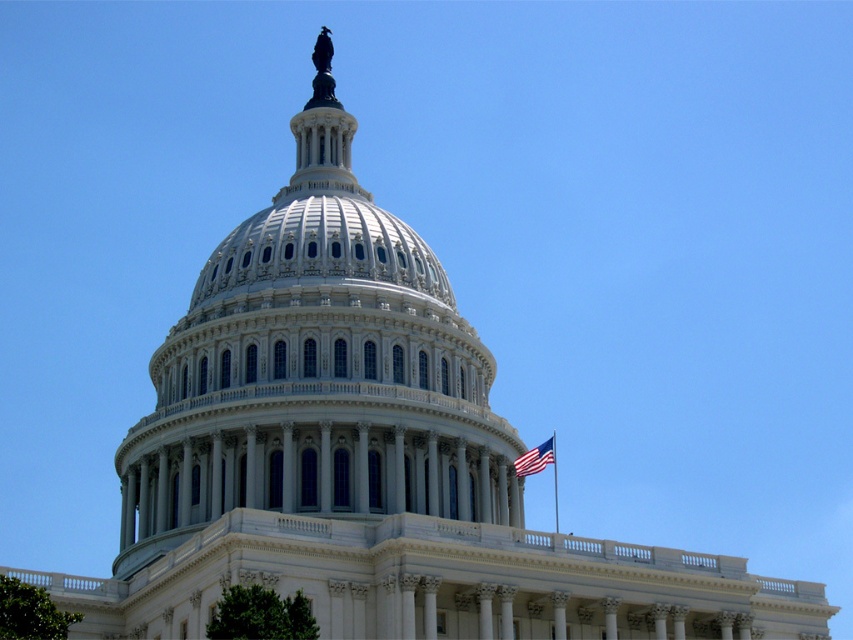
Question: Does white marble dome at center appear over american flag at right?

Choices:
 (A) no
 (B) yes

Answer: (B)

Question: Is white marble dome at center thinner than white flagpole at upper center?

Choices:
 (A) yes
 (B) no

Answer: (B)

Question: Does white marble dome at center have a smaller size compared to american flag at right?

Choices:
 (A) yes
 (B) no

Answer: (B)

Question: Based on their relative distances, which object is farther from the american flag at right?

Choices:
 (A) white marble dome at center
 (B) white flagpole at upper center

Answer: (A)

Question: Among these points, which one is nearest to the camera?

Choices:
 (A) (252, 467)
 (B) (535, 472)
 (C) (554, 502)

Answer: (B)

Question: Which point is farther from the camera taking this photo?

Choices:
 (A) (554, 444)
 (B) (538, 444)

Answer: (A)